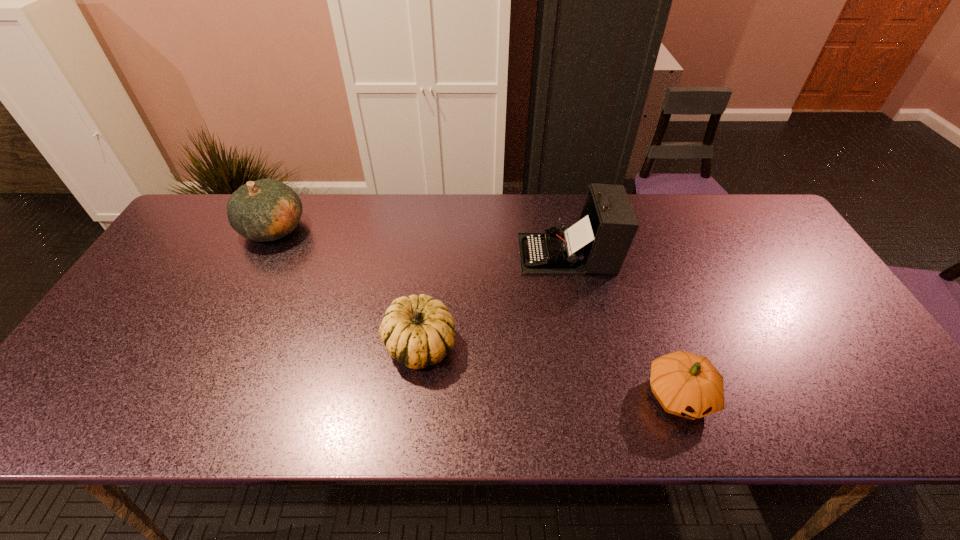
Where is `free spot between the second gourd from right to left and the rightmost gourd`? The height and width of the screenshot is (540, 960). free spot between the second gourd from right to left and the rightmost gourd is located at coordinates (550, 370).

You are a GUI agent. You are given a task and a screenshot of the screen. Output one action in this format:
    pyautogui.click(x=<x>, y=<y>)
    Task: Click on the free spot between the leftmost gourd and the second gourd from left to right
    The width and height of the screenshot is (960, 540).
    Given the screenshot: What is the action you would take?
    pyautogui.click(x=347, y=287)

Find the location of a particular element. The image size is (960, 540). vacant space in between the typewriter and the third object from right to left is located at coordinates click(493, 300).

Identify the location of vacant point located between the second object from left to right and the farthest gourd. (347, 287).

Locate an element on the screen. Image resolution: width=960 pixels, height=540 pixels. vacant point located between the third object from right to left and the tallest object is located at coordinates (493, 300).

Locate an element on the screen. Image resolution: width=960 pixels, height=540 pixels. vacant space that's between the third object from right to left and the third shortest object is located at coordinates (347, 287).

Find the location of a particular element. The height and width of the screenshot is (540, 960). vacant space in between the third object from right to left and the rightmost gourd is located at coordinates (550, 370).

Find the location of a particular element. Image resolution: width=960 pixels, height=540 pixels. empty space that is in between the third object from right to left and the rightmost gourd is located at coordinates (550, 370).

The image size is (960, 540). Identify the location of free area in between the rightmost gourd and the typewriter. (623, 325).

Identify the location of empty space between the tallest object and the tallest gourd. This screenshot has width=960, height=540. (420, 241).